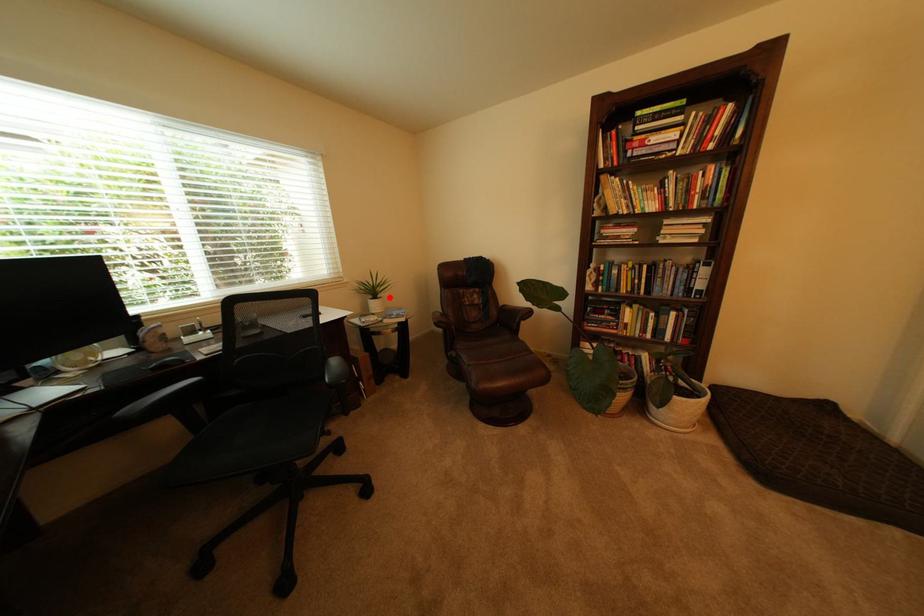
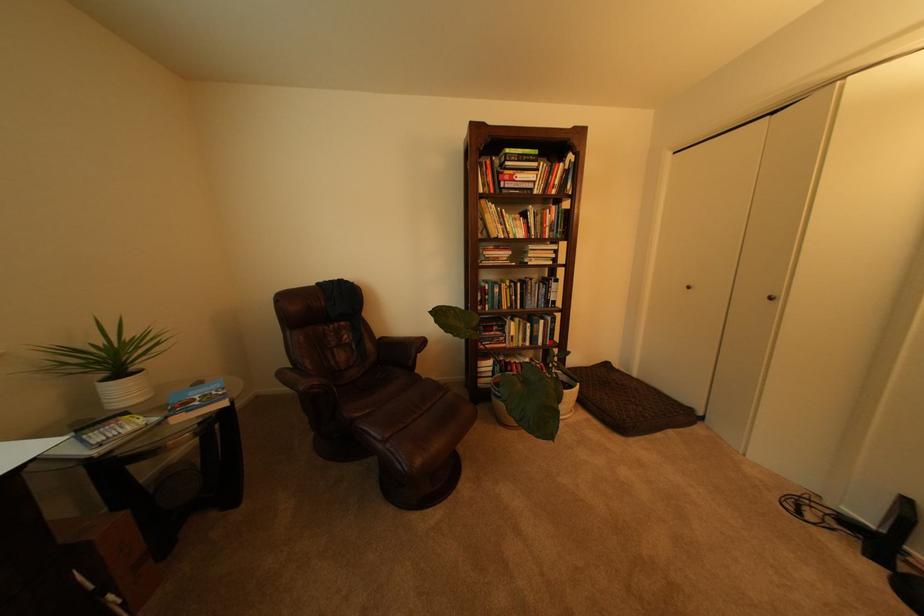
Question: I am providing you with two images of the same scene from different viewpoints. Given a red point in image1, look at the same physical point in image2. Is it:

Choices:
 (A) Closer to the viewpoint
 (B) Farther from the viewpoint

Answer: (B)